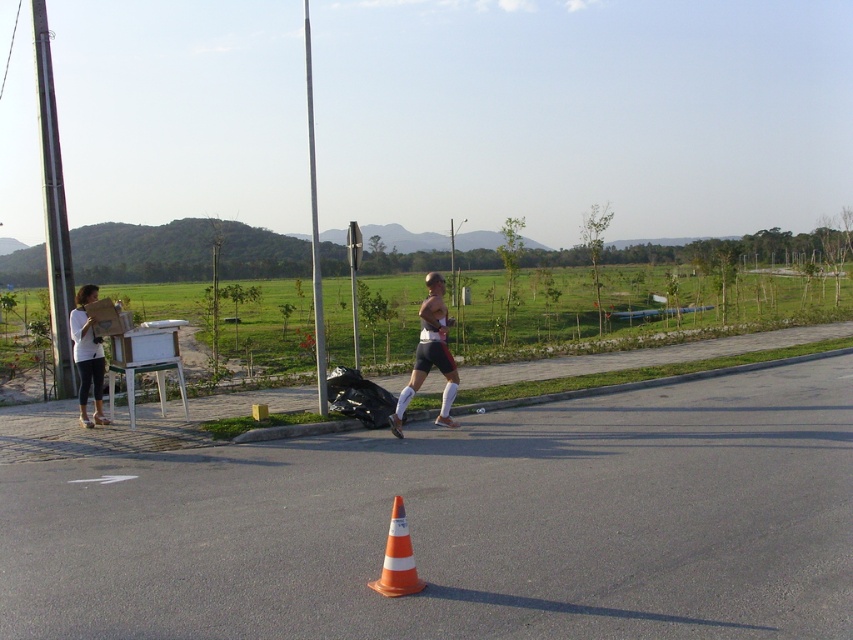
Question: Which object is positioned closest to the matte white shorts at center?

Choices:
 (A) white matte shirt at left
 (B) orange reflective cone at center

Answer: (A)

Question: Is matte white shorts at center to the left of orange reflective cone at center from the viewer's perspective?

Choices:
 (A) no
 (B) yes

Answer: (A)

Question: Is matte white shorts at center behind orange reflective cone at center?

Choices:
 (A) no
 (B) yes

Answer: (B)

Question: Estimate the real-world distances between objects in this image. Which object is closer to the matte white shorts at center?

Choices:
 (A) white matte shirt at left
 (B) orange reflective cone at center

Answer: (A)

Question: Does matte white shorts at center appear on the left side of orange reflective cone at center?

Choices:
 (A) yes
 (B) no

Answer: (B)

Question: Which point is closer to the camera taking this photo?

Choices:
 (A) (390, 573)
 (B) (96, 417)

Answer: (A)